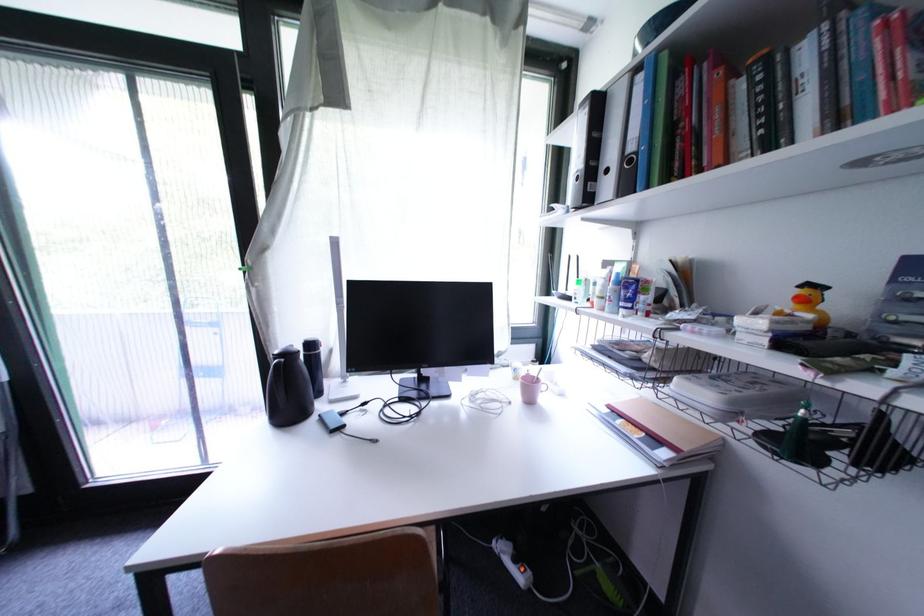
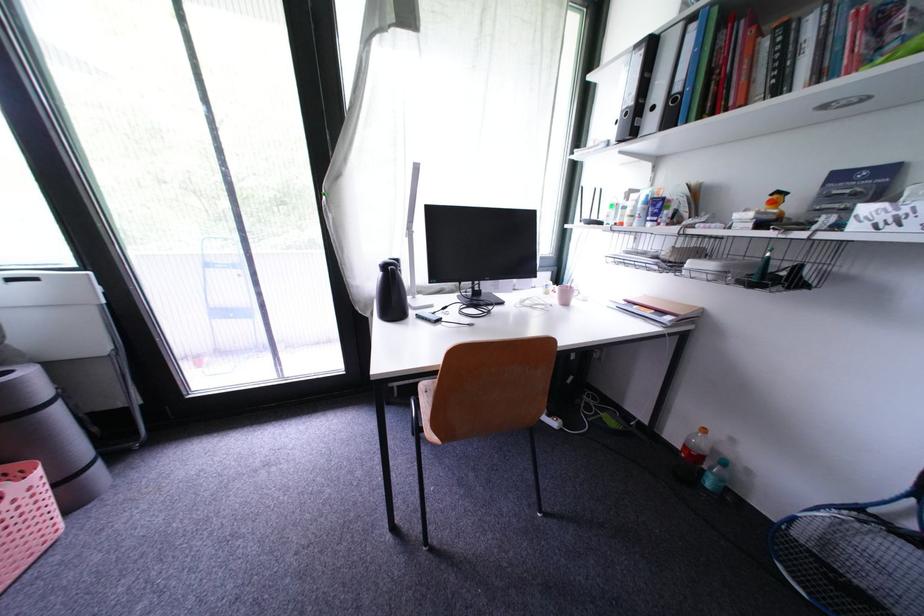
In the second image, find the point that corresponds to [694,450] in the first image.

(689, 315)